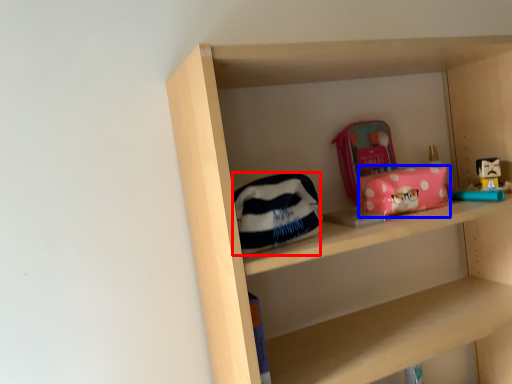
Question: Among these objects, which one is nearest to the camera, pouch (highlighted by a red box) or package (highlighted by a blue box)?

Choices:
 (A) pouch
 (B) package

Answer: (A)